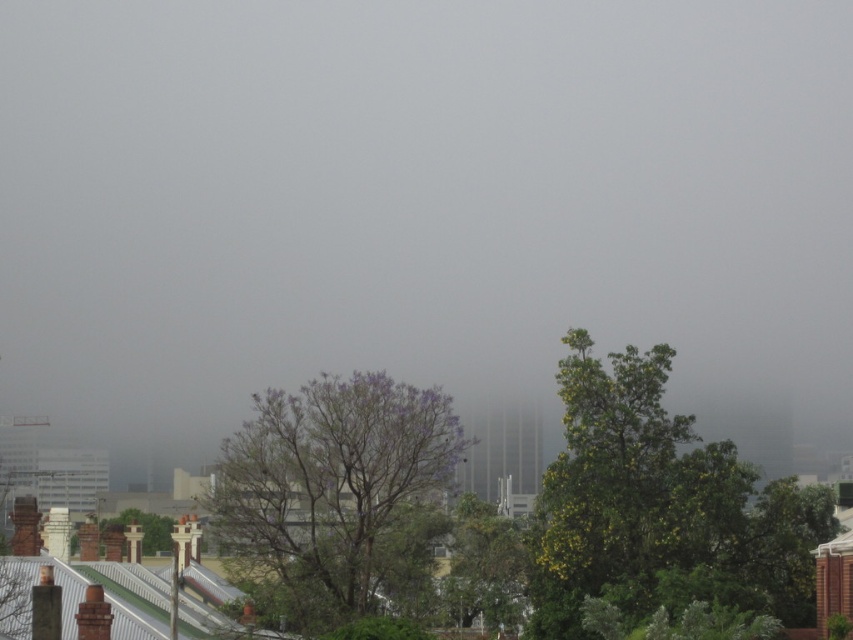
Does green leafy tree at right come in front of purple leafy tree at center?

No.

Is green leafy tree at right to the right of purple leafy tree at center from the viewer's perspective?

Indeed, green leafy tree at right is positioned on the right side of purple leafy tree at center.

Who is more forward, (560, 563) or (299, 461)?

Positioned in front is point (299, 461).

This screenshot has height=640, width=853. In order to click on green leafy tree at right in this screenshot , I will do `click(659, 508)`.

Is point (590, 456) closer to camera compared to point (115, 520)?

Yes, point (590, 456) is in front of point (115, 520).

Is green leafy tree at right positioned behind brown textured chimney at lower left?

No, green leafy tree at right is in front of brown textured chimney at lower left.

Does point (776, 589) lie in front of point (161, 547)?

Yes.

Identify the location of green leafy tree at right. (659, 508).

Locate an element on the screen. The width and height of the screenshot is (853, 640). purple leafy tree at center is located at coordinates (335, 490).

How far apart are purple leafy tree at center and brown textured chimney at lower left?

purple leafy tree at center and brown textured chimney at lower left are 71.50 meters apart.

The height and width of the screenshot is (640, 853). I want to click on purple leafy tree at center, so click(335, 490).

The width and height of the screenshot is (853, 640). I want to click on purple leafy tree at center, so click(x=335, y=490).